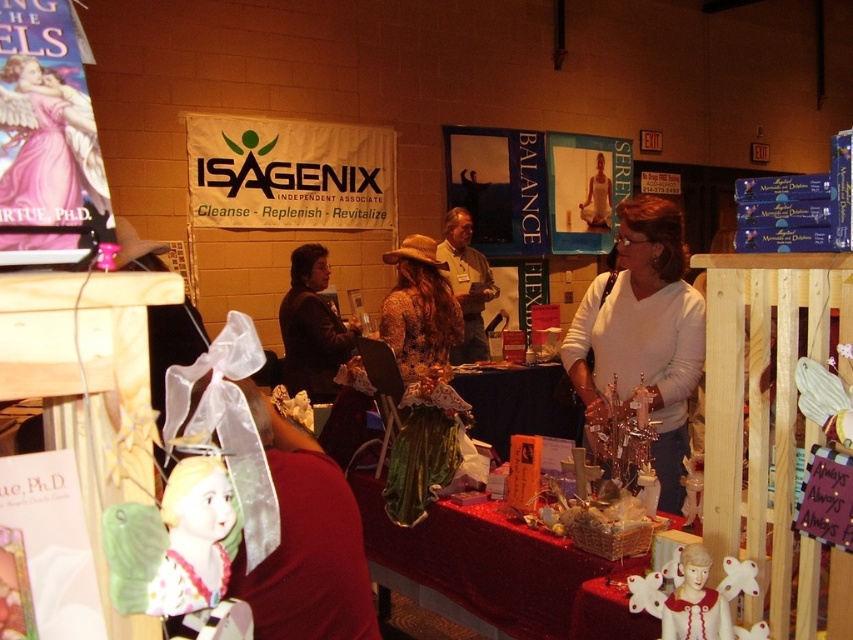
Does white porcelain angel at center have a greater width compared to matte brown hat at center?

Incorrect, white porcelain angel at center's width does not surpass matte brown hat at center's.

Does white porcelain angel at center have a smaller size compared to matte brown hat at center?

Indeed, white porcelain angel at center has a smaller size compared to matte brown hat at center.

Who is more forward, (666, 600) or (463, 353)?

Point (666, 600)

Identify the location of white porcelain angel at center. (695, 596).

Based on the photo, does white matte sweater at center have a greater width compared to shiny red fabric table at center?

No.

Which is in front, point (648, 381) or point (438, 528)?

Point (648, 381) is in front.

Where is `white matte sweater at center`? The image size is (853, 640). white matte sweater at center is located at coordinates (x=642, y=333).

Based on the photo, which is more to the left, white porcelain angel at center or dark brown leather jacket at center?

dark brown leather jacket at center

Can you confirm if white porcelain angel at center is shorter than dark brown leather jacket at center?

Indeed, white porcelain angel at center has a lesser height compared to dark brown leather jacket at center.

Who is more distant from viewer, (x=688, y=596) or (x=312, y=285)?

Positioned behind is point (x=312, y=285).

This screenshot has height=640, width=853. What are the coordinates of `white porcelain angel at center` in the screenshot? It's located at (695, 596).